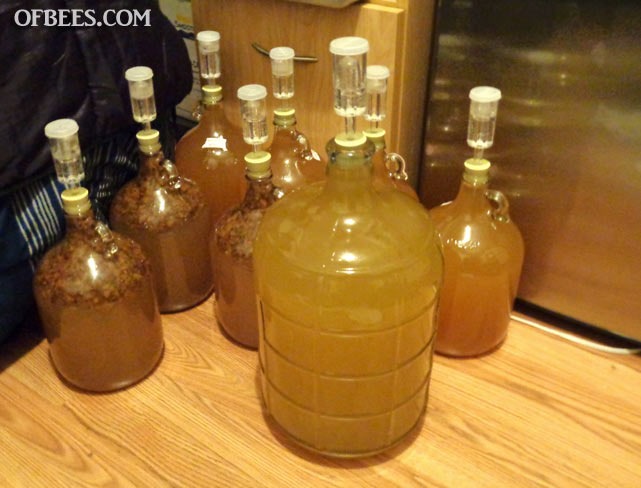
What are the coordinates of `bottle` in the screenshot? It's located at tap(133, 345).